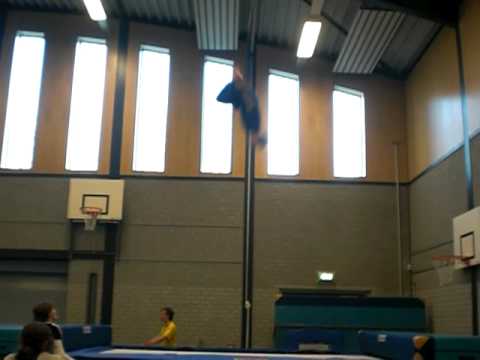
Locate an element on the screen. The width and height of the screenshot is (480, 360). light is located at coordinates (325, 278), (310, 31).